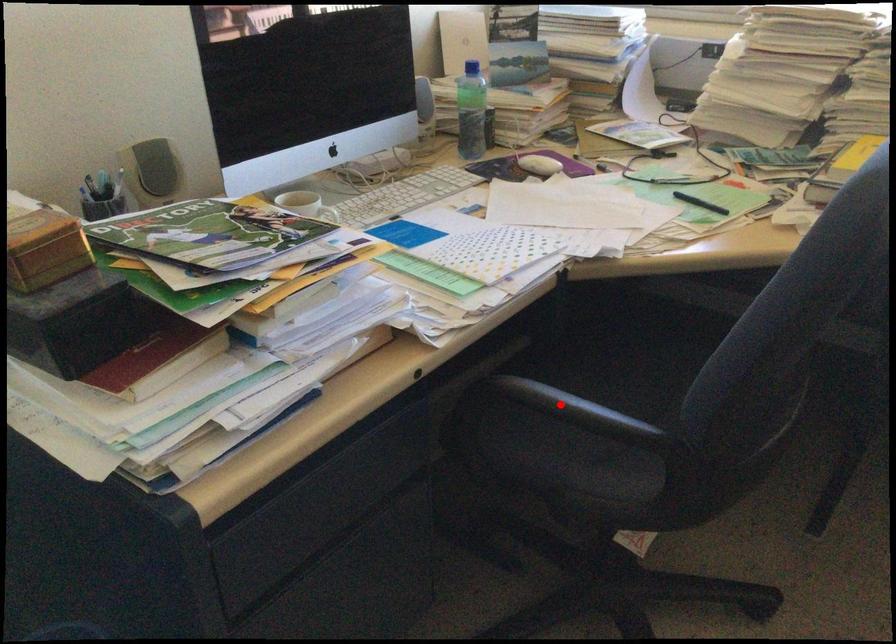
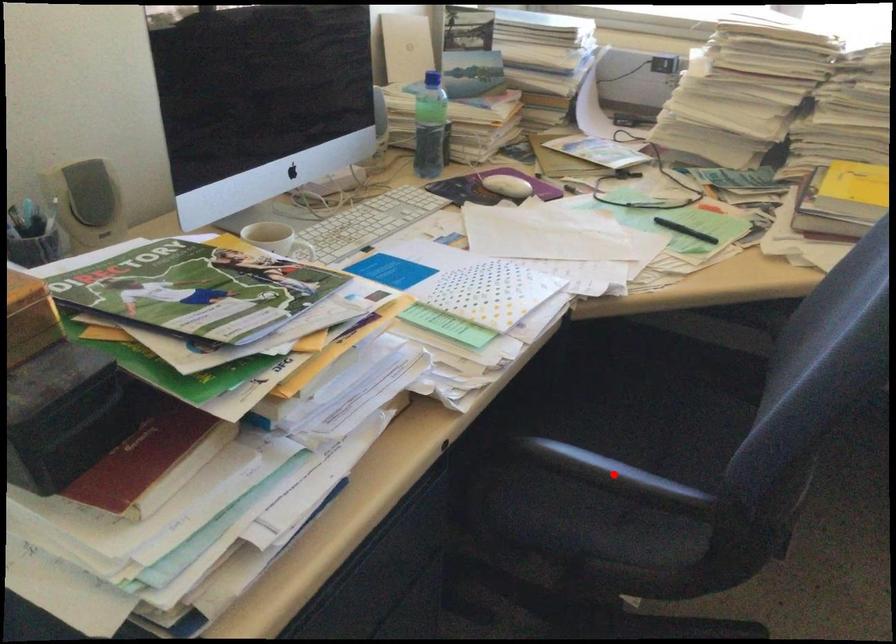
I am providing you with two images of the same scene from different viewpoints. A red point is marked on the first image and another point is marked on the second image. Do the highlighted points in image1 and image2 indicate the same real-world spot?

Yes